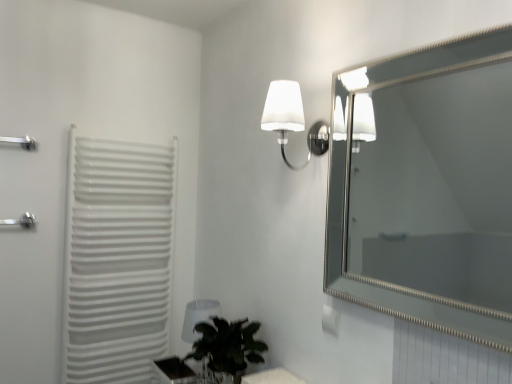
Question: Would you say translucent glass table at lower center is to the left or to the right of silver metallic towel bar at left in the picture?

Choices:
 (A) right
 (B) left

Answer: (A)

Question: From the image's perspective, relative to silver metallic towel bar at left, is translucent glass table at lower center above or below?

Choices:
 (A) above
 (B) below

Answer: (B)

Question: Based on their relative distances, which object is farther from the silver metallic shower at left?

Choices:
 (A) green leafy plant at lower center
 (B) transparent plastic table lamp at lower center
 (C) translucent glass table at lower center
 (D) white plastic radiator at left
 (E) white frosted glass wall sconce at upper center

Answer: (E)

Question: Which is nearer to the green leafy plant at lower center?

Choices:
 (A) white plastic radiator at left
 (B) white frosted glass wall sconce at upper center
 (C) transparent plastic table lamp at lower center
 (D) translucent glass table at lower center
 (E) silver/metallic mirror at upper right

Answer: (D)